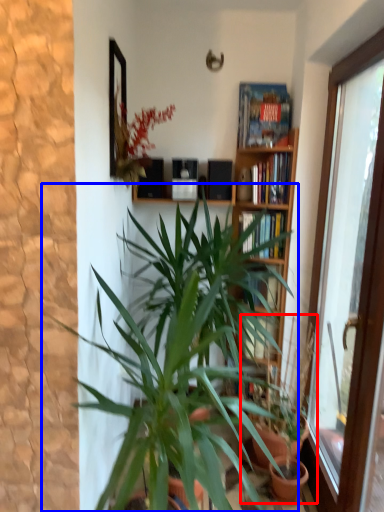
Question: Which of the following is the closest to the observer, houseplant (highlighted by a red box) or houseplant (highlighted by a blue box)?

Choices:
 (A) houseplant
 (B) houseplant

Answer: (B)